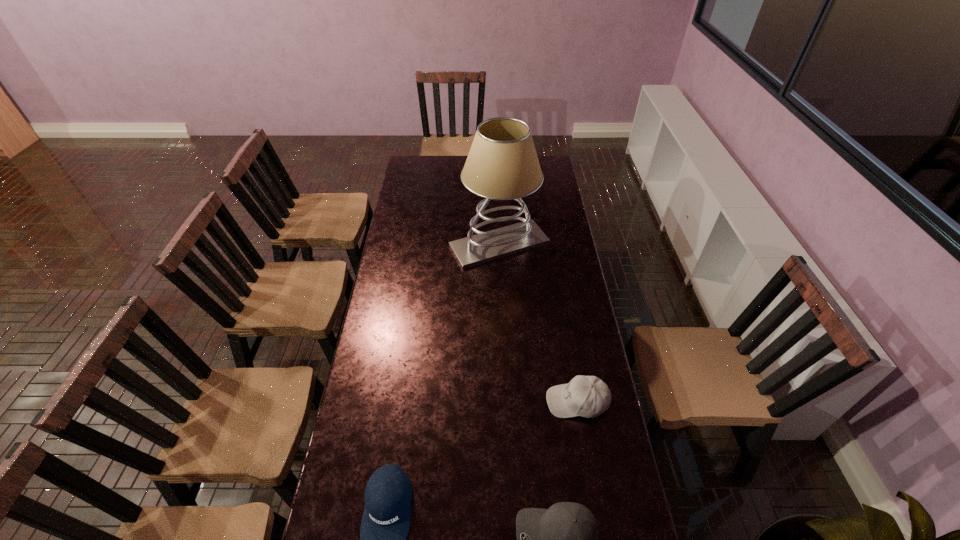
Find the location of a particular element. free space at the right edge of the desktop is located at coordinates (558, 335).

Where is `free point at the far left corner`? This screenshot has width=960, height=540. free point at the far left corner is located at coordinates (420, 160).

At what (x,y) coordinates should I click in order to perform the action: click on vacant area that lies between the tallest object and the farthest baseball cap. Please return your answer as a coordinate pair (x, y). Looking at the image, I should click on (538, 323).

Where is `free spot between the tallest object and the farthest baseball cap`? free spot between the tallest object and the farthest baseball cap is located at coordinates (538, 323).

In order to click on blank region between the third nearest object and the table lamp in this screenshot , I will do `click(538, 323)`.

Identify the location of object that stands as the closest to the farthest baseball cap. (564, 539).

The height and width of the screenshot is (540, 960). What are the coordinates of `object that is the second closest to the leftmost baseball cap` in the screenshot? It's located at (588, 396).

Identify which baseball cap is the nearest to the leftmost baseball cap. Please provide its 2D coordinates. Your answer should be formatted as a tuple, i.e. [(x, y)], where the tuple contains the x and y coordinates of a point satisfying the conditions above.

[(564, 539)]

You are a GUI agent. You are given a task and a screenshot of the screen. Output one action in this format:
    pyautogui.click(x=<x>, y=<y>)
    Task: Click on the baseball cap that is the nearest to the leftmost object
    The width and height of the screenshot is (960, 540).
    Given the screenshot: What is the action you would take?
    pyautogui.click(x=564, y=539)